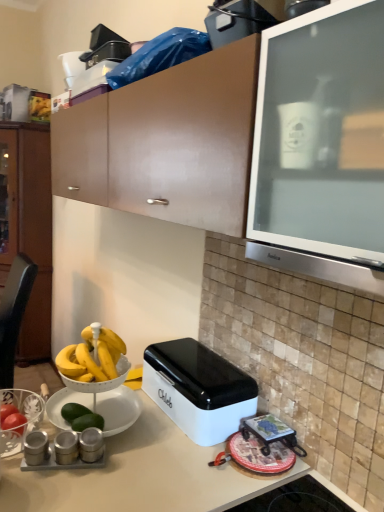
Question: In terms of width, does brown matte cabinet at left look wider or thinner when compared to silver metallic spice containers at lower left, placed as the 1th appliance when sorted from bottom to top?

Choices:
 (A) thin
 (B) wide

Answer: (B)

Question: Is brown matte cabinet at left taller or shorter than silver metallic spice containers at lower left, the 3th appliance from the back?

Choices:
 (A) short
 (B) tall

Answer: (B)

Question: Estimate the real-world distances between objects in this image. Which object is farther from the silver metallic salt and pepper shakers at lower left, positioned as the 4th appliance in top-to-bottom order?

Choices:
 (A) metallic silver canisters at lower left, the 6th appliance positioned from the back
 (B) satin silver canisters at lower left, which ranks as the second appliance in bottom-to-top order
 (C) white plastic appliance at upper center, which is counted as the first appliance, starting from the top
 (D) black leather chair at left
 (E) white glossy breadbox at lower center

Answer: (C)

Question: Based on their relative distances, which object is farther from the white glossy breadbox at lower center?

Choices:
 (A) brown matte cabinet at left
 (B) black leather chair at left
 (C) silver metallic salt and pepper shakers at lower left, the 3th appliance in the front-to-back sequence
 (D) silver metallic spice containers at lower left, the 3th appliance from the back
 (E) satin silver canisters at lower left, which is the 5th appliance in top-to-bottom order

Answer: (A)